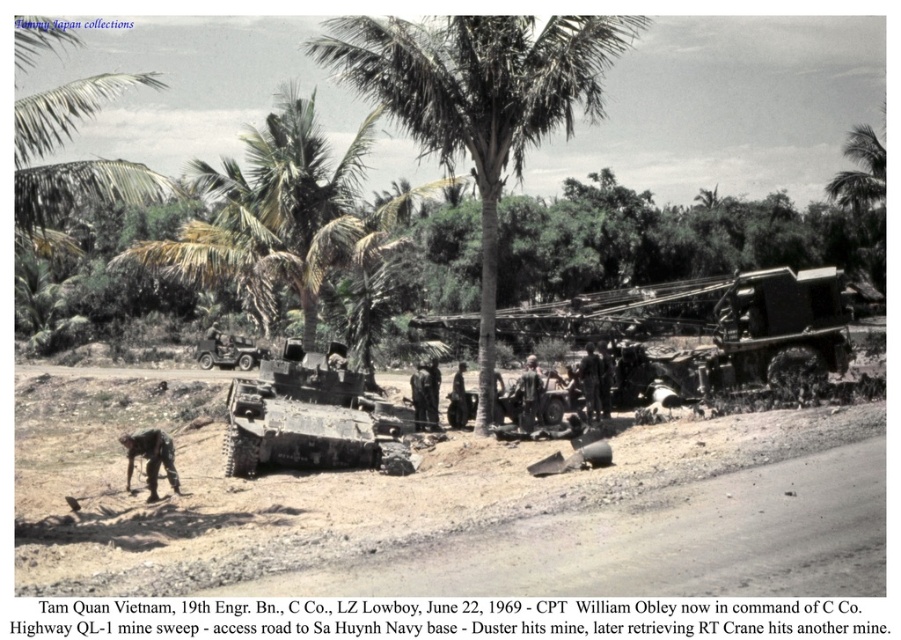
Question: Which of these objects is positioned closest to the dark gray uniform at center?

Choices:
 (A) camouflage paint tank at center
 (B) green leafy palm tree at center

Answer: (A)

Question: Where is dark gray uniform at center located in relation to dark brown leather boots at center in the image?

Choices:
 (A) left
 (B) right

Answer: (B)

Question: Is camouflage fabric soldier at lower left positioned at the back of matte green jeep at center-left?

Choices:
 (A) no
 (B) yes

Answer: (A)

Question: Is brown dirt track at center positioned at the back of green leafy palm tree at center?

Choices:
 (A) yes
 (B) no

Answer: (B)

Question: Which object is positioned farthest from the matte green jeep at center-left?

Choices:
 (A) brown dirt track at center
 (B) dark brown leather boots at center
 (C) camouflage fabric soldier at lower left

Answer: (C)

Question: Which of the following is the farthest from the observer?

Choices:
 (A) camouflage fabric soldier at lower left
 (B) camouflage paint tank at center
 (C) matte green jeep at center-left
 (D) dark gray uniform at center

Answer: (C)